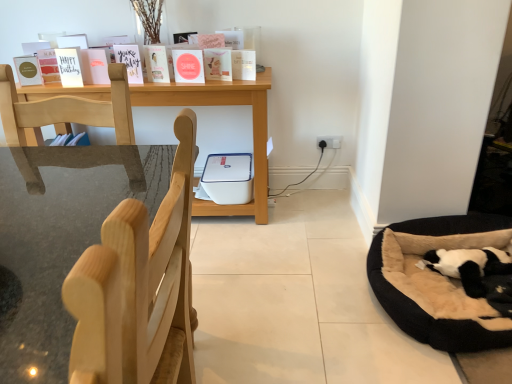
Locate an element on the screen. The image size is (512, 384). empty space that is in between wooden table at center and black plush dog bed at lower right is located at coordinates (291, 264).